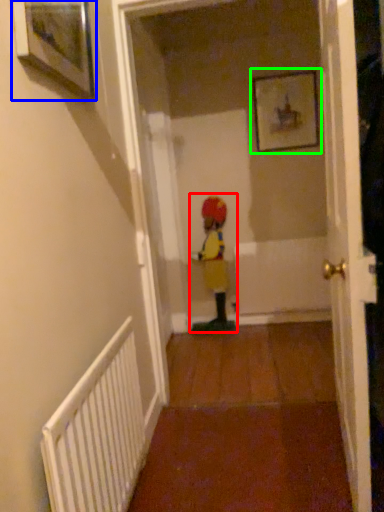
Question: Considering the real-world distances, which object is farthest from person (highlighted by a red box)? picture frame (highlighted by a blue box) or picture frame (highlighted by a green box)?

Choices:
 (A) picture frame
 (B) picture frame

Answer: (A)